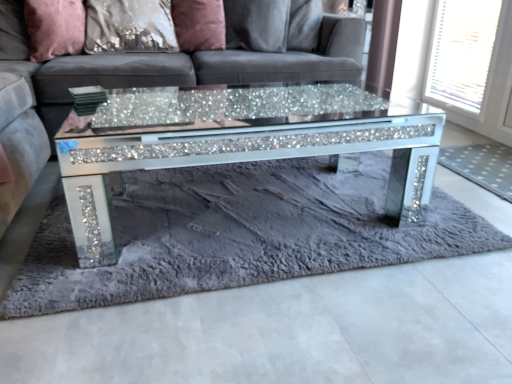
The image size is (512, 384). I want to click on satin sequin pillow at upper center, which ranks as the 2th pillow in right-to-left order, so click(x=129, y=26).

Considering the relative sizes of sparkly glass coffee table at center and fuzzy gray rug at center, which is the 1th mat from left to right, in the image provided, is sparkly glass coffee table at center shorter than fuzzy gray rug at center, which is the 1th mat from left to right,?

No, sparkly glass coffee table at center is not shorter than fuzzy gray rug at center, which is the 1th mat from left to right.

This screenshot has height=384, width=512. There is a fuzzy gray rug at center, the second mat positioned from the right. What are the coordinates of `coffee table above it (from a real-world perspective)` in the screenshot? It's located at (241, 144).

Is fuzzy gray rug at center, the second mat positioned from the right, a part of sparkly glass coffee table at center?

No, fuzzy gray rug at center, the second mat positioned from the right, is not a part of sparkly glass coffee table at center.

Is sparkly glass coffee table at center far away from fuzzy gray rug at center, the second mat positioned from the right?

sparkly glass coffee table at center is near fuzzy gray rug at center, the second mat positioned from the right, not far away.

Considering the relative positions of satin sequin pillow at upper center, which ranks as the 2th pillow in right-to-left order, and pink velvet pillow at upper left, which is the first pillow in left-to-right order, in the image provided, is satin sequin pillow at upper center, which ranks as the 2th pillow in right-to-left order, to the left of pink velvet pillow at upper left, which is the first pillow in left-to-right order, from the viewer's perspective?

In fact, satin sequin pillow at upper center, which ranks as the 2th pillow in right-to-left order, is to the right of pink velvet pillow at upper left, which is the first pillow in left-to-right order.

Does point (105, 0) appear closer or farther from the camera than point (77, 41)?

Point (105, 0) appears to be farther away from the viewer than point (77, 41).

From the image's perspective, which is below, satin sequin pillow at upper center, which ranks as the 2th pillow in right-to-left order, or pink velvet pillow at upper left, which is the first pillow in left-to-right order?

pink velvet pillow at upper left, which is the first pillow in left-to-right order, appears lower in the image.

Does satin sequin pillow at upper center, arranged as the second pillow when viewed from the left, touch sparkly glass coffee table at center?

There is a gap between satin sequin pillow at upper center, arranged as the second pillow when viewed from the left, and sparkly glass coffee table at center.

From the image's perspective, is satin sequin pillow at upper center, which ranks as the 2th pillow in right-to-left order, beneath sparkly glass coffee table at center?

No, from the image's perspective, satin sequin pillow at upper center, which ranks as the 2th pillow in right-to-left order, is not below sparkly glass coffee table at center.

Is satin sequin pillow at upper center, which ranks as the 2th pillow in right-to-left order, aimed at sparkly glass coffee table at center?

Yes, satin sequin pillow at upper center, which ranks as the 2th pillow in right-to-left order, is facing sparkly glass coffee table at center.

Is sparkly glass coffee table at center completely or partially inside satin sequin pillow at upper center, arranged as the second pillow when viewed from the left?

That's incorrect, sparkly glass coffee table at center is not inside satin sequin pillow at upper center, arranged as the second pillow when viewed from the left.

Can you confirm if satin pink pillow at upper center, the third pillow from the left, is thinner than sparkly glass coffee table at center?

Yes.

How different are the orientations of satin pink pillow at upper center, the first pillow positioned from the right, and sparkly glass coffee table at center in degrees?

27.7 degrees.

Between satin pink pillow at upper center, the third pillow from the left, and sparkly glass coffee table at center, which one is positioned in front?

Positioned in front is sparkly glass coffee table at center.

Is satin pink pillow at upper center, the third pillow from the left, oriented towards sparkly glass coffee table at center?

Yes, satin pink pillow at upper center, the third pillow from the left, is facing sparkly glass coffee table at center.

From the image's perspective, between white mesh screen at upper right and velvet grey couch at center, which one is located above?

From the image's view, white mesh screen at upper right is above.

Could velvet grey couch at center be considered to be inside white mesh screen at upper right?

No.

Who is smaller, white mesh screen at upper right or velvet grey couch at center?

white mesh screen at upper right is smaller.

Between white dotted mat at right, the 2th mat in the left-to-right sequence, and satin pink pillow at upper center, the third pillow from the left, which one has smaller width?

With smaller width is satin pink pillow at upper center, the third pillow from the left.

From the image's perspective, would you say white dotted mat at right, which is the first mat from right to left, is positioned over satin pink pillow at upper center, the third pillow from the left?

Actually, white dotted mat at right, which is the first mat from right to left, appears below satin pink pillow at upper center, the third pillow from the left, in the image.

Is white dotted mat at right, which is the first mat from right to left, to the right of satin pink pillow at upper center, the third pillow from the left, from the viewer's perspective?

Indeed, white dotted mat at right, which is the first mat from right to left, is positioned on the right side of satin pink pillow at upper center, the third pillow from the left.

From a real-world perspective, which object stands above the other?

satin pink pillow at upper center, the third pillow from the left, from a real-world perspective.

From the image's perspective, is satin pink pillow at upper center, the third pillow from the left, over pink velvet pillow at upper left, which is counted as the third pillow, starting from the right?

Indeed, from the image's perspective, satin pink pillow at upper center, the third pillow from the left, is shown above pink velvet pillow at upper left, which is counted as the third pillow, starting from the right.

Which of these two, satin pink pillow at upper center, the first pillow positioned from the right, or pink velvet pillow at upper left, which is the first pillow in left-to-right order, is bigger?

pink velvet pillow at upper left, which is the first pillow in left-to-right order, is bigger.

Between satin pink pillow at upper center, the first pillow positioned from the right, and pink velvet pillow at upper left, which is the first pillow in left-to-right order, which one has less height?

Standing shorter between the two is pink velvet pillow at upper left, which is the first pillow in left-to-right order.

Is satin pink pillow at upper center, the first pillow positioned from the right, facing away from pink velvet pillow at upper left, which is the first pillow in left-to-right order?

No, satin pink pillow at upper center, the first pillow positioned from the right, is not facing away from pink velvet pillow at upper left, which is the first pillow in left-to-right order.

Which mat is the 1st one when counting from the right side of the sparkly glass coffee table at center? Please provide its 2D coordinates.

[(238, 234)]

Locate an element on the screen. This screenshot has width=512, height=384. pillow located on the left of satin sequin pillow at upper center, which ranks as the 2th pillow in right-to-left order is located at coordinates (55, 28).

Based on their spatial positions, is white mesh screen at upper right or sparkly glass coffee table at center further from pink velvet pillow at upper left, which is the first pillow in left-to-right order?

white mesh screen at upper right.

When comparing their distances from white dotted mat at right, which is the first mat from right to left, does sparkly glass coffee table at center or fuzzy gray rug at center, which is the 1th mat from left to right, seem further?

fuzzy gray rug at center, which is the 1th mat from left to right, lies further to white dotted mat at right, which is the first mat from right to left, than the other object.

Considering their positions, is white dotted mat at right, the 2th mat in the left-to-right sequence, positioned closer to satin sequin pillow at upper center, which ranks as the 2th pillow in right-to-left order, than fuzzy gray rug at center, which is the 1th mat from left to right?

fuzzy gray rug at center, which is the 1th mat from left to right.

Which object lies further to the anchor point white mesh screen at upper right, satin pink pillow at upper center, the first pillow positioned from the right, or pink velvet pillow at upper left, which is counted as the third pillow, starting from the right?

pink velvet pillow at upper left, which is counted as the third pillow, starting from the right.

Consider the image. Based on their spatial positions, is fuzzy gray rug at center, the second mat positioned from the right, or white mesh screen at upper right further from velvet grey couch at center?

Among the two, white mesh screen at upper right is located further to velvet grey couch at center.

Considering their positions, is satin pink pillow at upper center, the first pillow positioned from the right, positioned further to velvet grey couch at center than satin sequin pillow at upper center, which ranks as the 2th pillow in right-to-left order?

satin pink pillow at upper center, the first pillow positioned from the right, lies further to velvet grey couch at center than the other object.

Considering their positions, is satin pink pillow at upper center, the first pillow positioned from the right, positioned closer to pink velvet pillow at upper left, which is counted as the third pillow, starting from the right, than white mesh screen at upper right?

satin pink pillow at upper center, the first pillow positioned from the right.

Based on their spatial positions, is fuzzy gray rug at center, the second mat positioned from the right, or white dotted mat at right, which is the first mat from right to left, closer to pink velvet pillow at upper left, which is the first pillow in left-to-right order?

Among the two, fuzzy gray rug at center, the second mat positioned from the right, is located nearer to pink velvet pillow at upper left, which is the first pillow in left-to-right order.

Locate an element on the screen. coffee table located between fuzzy gray rug at center, which is the 1th mat from left to right, and satin sequin pillow at upper center, arranged as the second pillow when viewed from the left, in the depth direction is located at coordinates (241, 144).

Where is `mat between fuzzy gray rug at center, which is the 1th mat from left to right, and white mesh screen at upper right`? mat between fuzzy gray rug at center, which is the 1th mat from left to right, and white mesh screen at upper right is located at coordinates (482, 166).

I want to click on pillow between pink velvet pillow at upper left, which is the first pillow in left-to-right order, and satin pink pillow at upper center, the first pillow positioned from the right, from left to right, so click(129, 26).

This screenshot has height=384, width=512. Find the location of `coffee table between fuzzy gray rug at center, which is the 1th mat from left to right, and satin pink pillow at upper center, the first pillow positioned from the right, along the z-axis`. coffee table between fuzzy gray rug at center, which is the 1th mat from left to right, and satin pink pillow at upper center, the first pillow positioned from the right, along the z-axis is located at coordinates (241, 144).